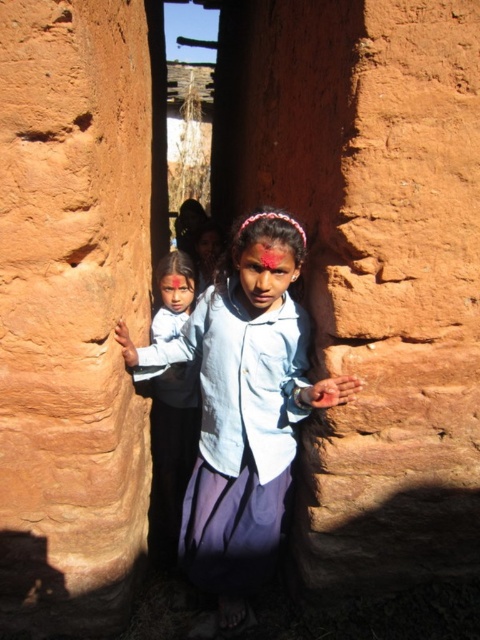
Question: Does light blue denim shirt at center appear over matte blue shirt at center?

Choices:
 (A) yes
 (B) no

Answer: (B)

Question: Which object appears closest to the camera in this image?

Choices:
 (A) matte clay wall at center
 (B) light blue denim shirt at center

Answer: (A)

Question: Is matte clay wall at center to the right of matte blue shirt at center from the viewer's perspective?

Choices:
 (A) no
 (B) yes

Answer: (A)

Question: Which object is the farthest from the matte clay wall at center?

Choices:
 (A) matte blue shirt at center
 (B) light blue denim shirt at center

Answer: (A)

Question: Observing the image, what is the correct spatial positioning of matte clay wall at center in reference to matte blue shirt at center?

Choices:
 (A) above
 (B) below

Answer: (A)

Question: Which of these objects is positioned closest to the matte clay wall at center?

Choices:
 (A) matte blue shirt at center
 (B) light blue denim shirt at center

Answer: (B)